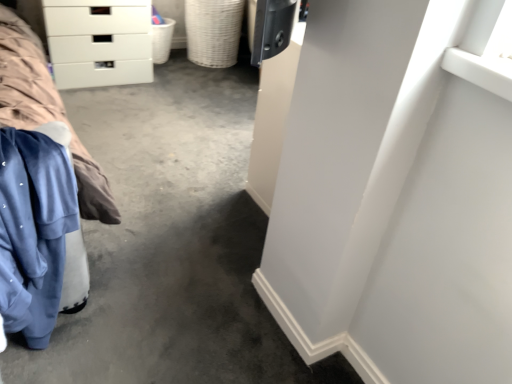
Locate an element on the screen. This screenshot has height=384, width=512. free point in front of woven beige basket at center, the second basket viewed from the left is located at coordinates (208, 77).